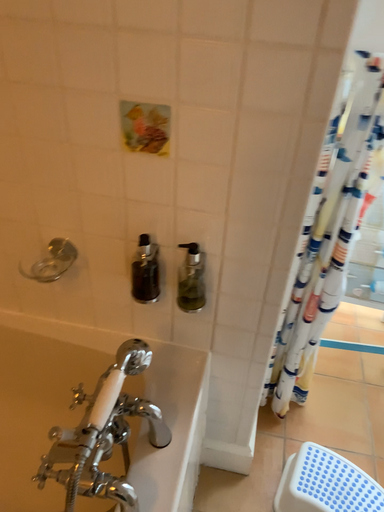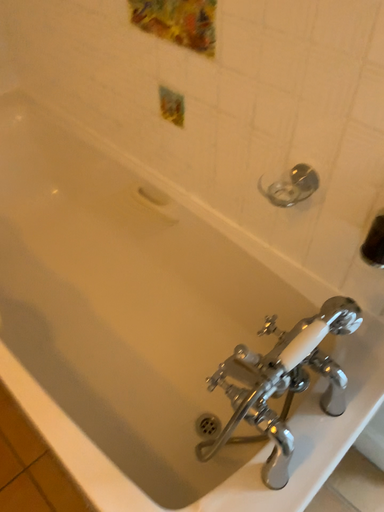
Question: How did the camera likely rotate when shooting the video?

Choices:
 (A) rotated right
 (B) rotated left

Answer: (B)